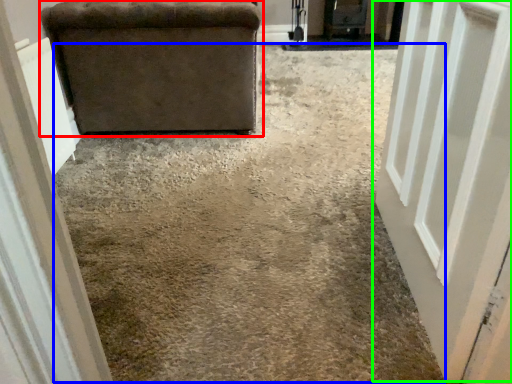
Question: Which is nearer to the furniture (highlighted by a red box)? concrete (highlighted by a blue box) or door (highlighted by a green box).

Choices:
 (A) concrete
 (B) door

Answer: (A)